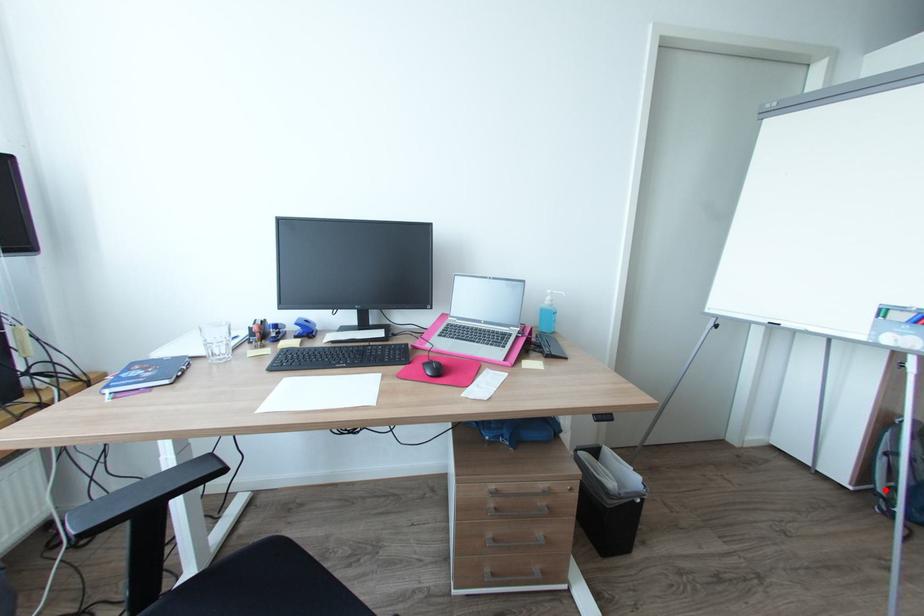
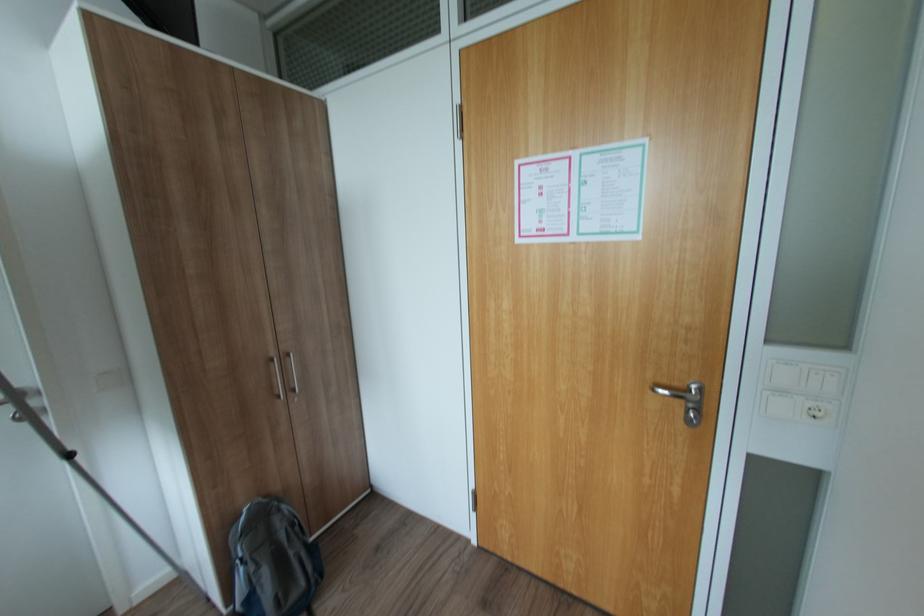
Where in the second image is the point corresponding to the highlighted location from the first image?

(244, 608)